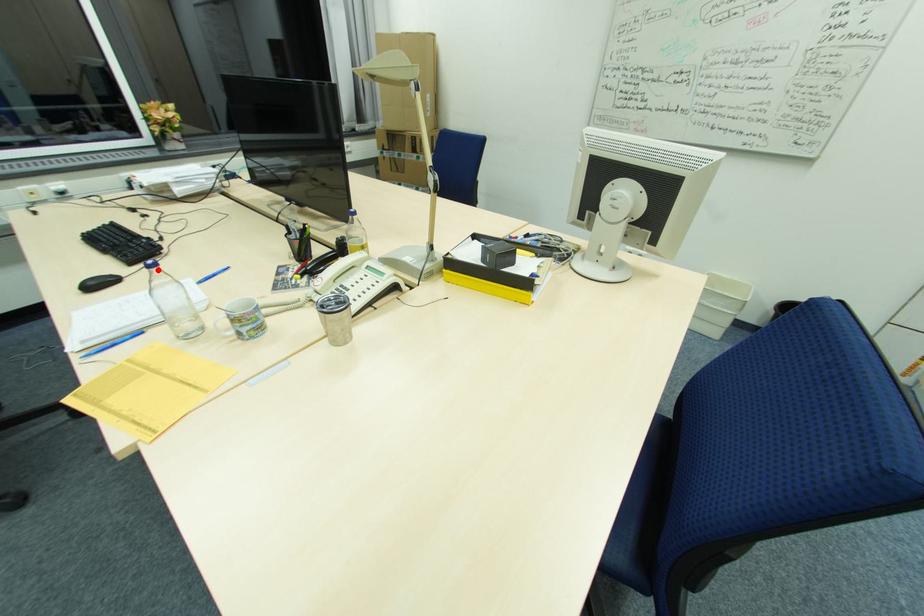
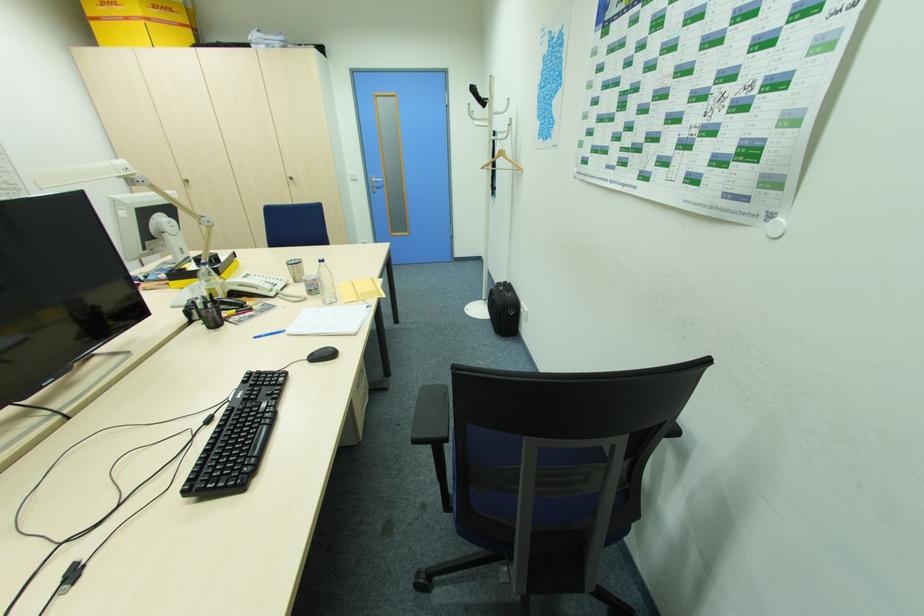
Where in the second image is the point corresponding to the highlighted location from the first image?

(324, 264)